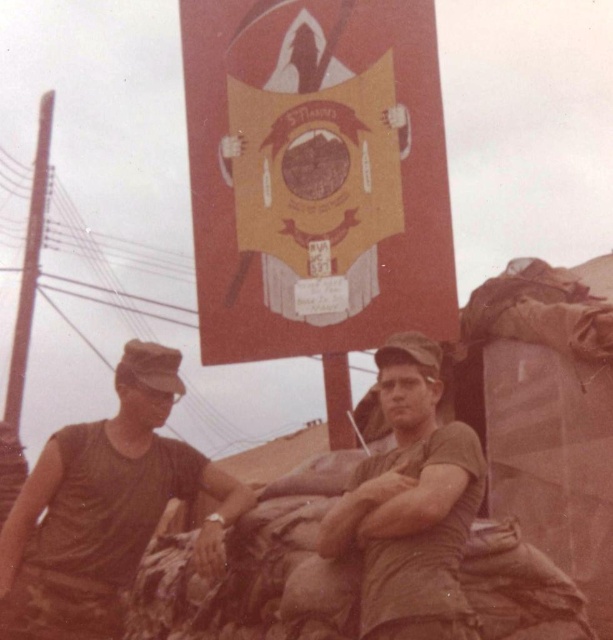
Question: Observing the image, what is the correct spatial positioning of camouflage fabric uniform at left in reference to matte green uniform at center?

Choices:
 (A) left
 (B) right

Answer: (A)

Question: Can you confirm if camouflage fabric uniform at left is positioned to the right of matte green uniform at center?

Choices:
 (A) no
 (B) yes

Answer: (A)

Question: Can you confirm if camouflage fabric uniform at left is thinner than matte green uniform at center?

Choices:
 (A) no
 (B) yes

Answer: (A)